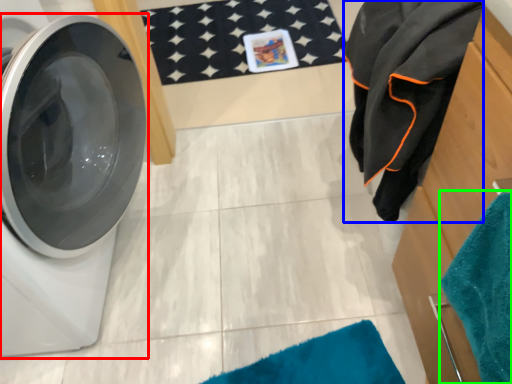
Question: Which object is the closest to the washing machine (highlighted by a red box)? Choose among these: bath towel (highlighted by a blue box) or beach towel (highlighted by a green box).

Choices:
 (A) bath towel
 (B) beach towel

Answer: (A)